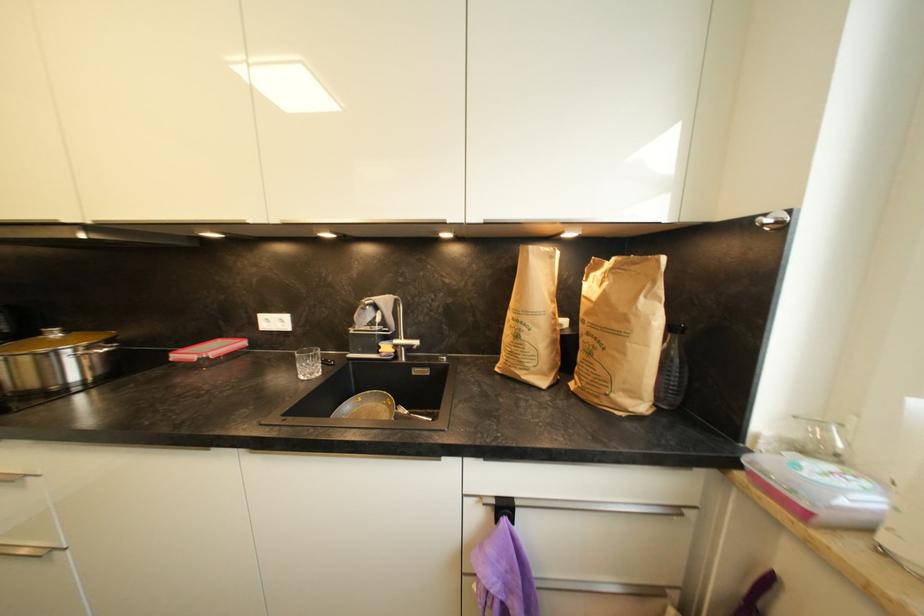
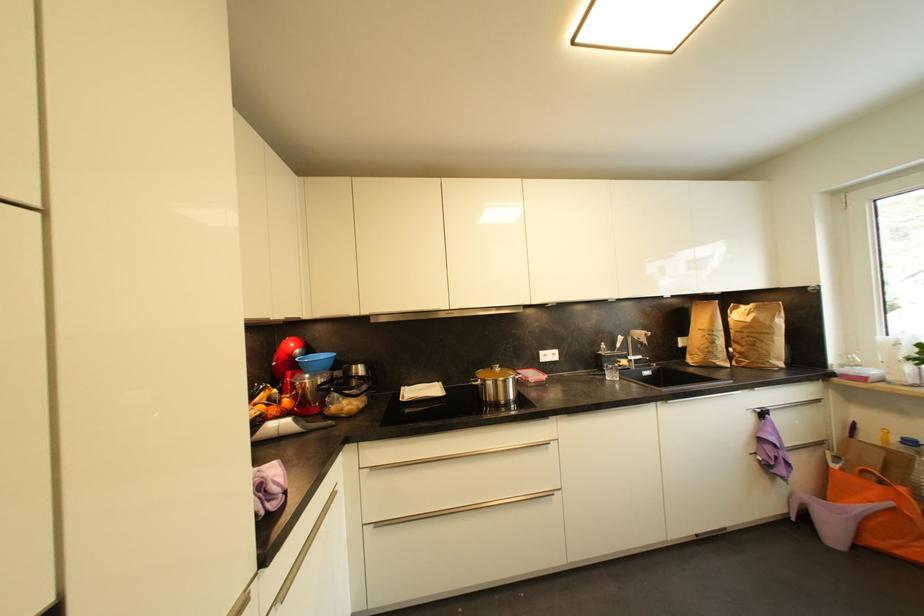
Find the pixel in the second image that matches pixel 421 344 in the first image.

(645, 359)